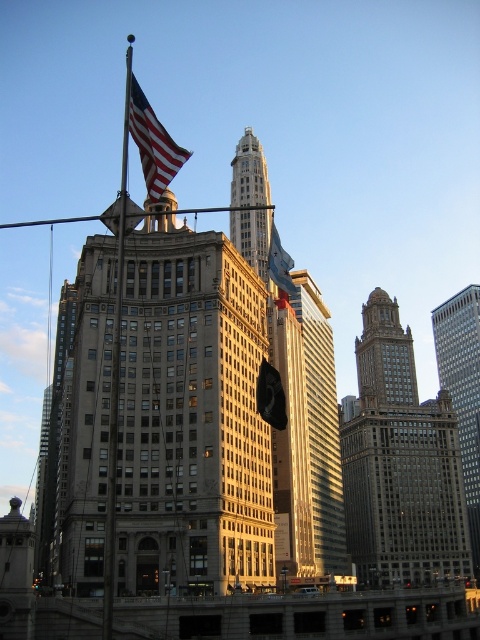
Question: Which point is closer to the camera taking this photo?

Choices:
 (A) (288, 282)
 (B) (286, 426)
 (C) (127, 150)

Answer: (B)

Question: Does gold reflective glass skyscraper at center have a greater width compared to gold glass skyscraper at center?

Choices:
 (A) yes
 (B) no

Answer: (A)

Question: Does brick textured building at center appear over american flag at center?

Choices:
 (A) yes
 (B) no

Answer: (B)

Question: Does polished metal flag pole at center have a larger size compared to american flag at upper left?

Choices:
 (A) no
 (B) yes

Answer: (B)

Question: Which of the following is the closest to the observer?

Choices:
 (A) brick textured building at center
 (B) polished metal flag pole at center
 (C) gold reflective glass skyscraper at center

Answer: (B)

Question: Among these points, which one is nearest to the camera?

Choices:
 (A) (334, 381)
 (B) (358, 444)
 (C) (243, 248)

Answer: (C)